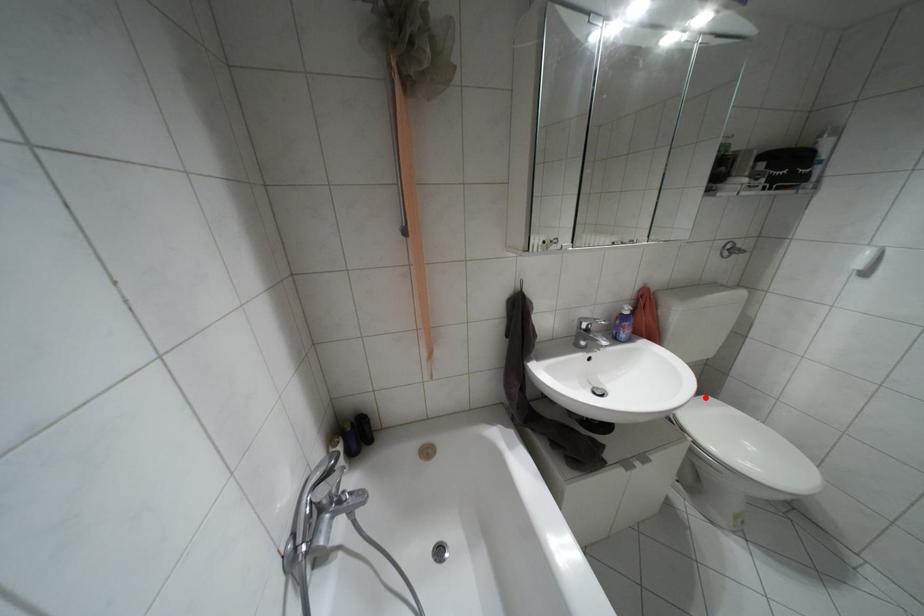
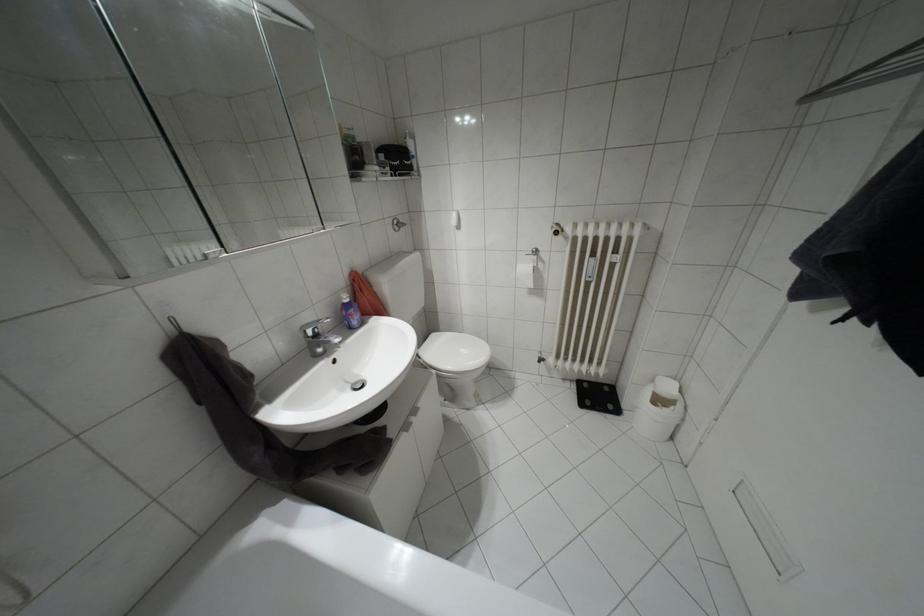
Question: I am providing you with two images of the same scene from different viewpoints. In image1, a red point is highlighted. Considering the same 3D point in image2, which of the following is correct?

Choices:
 (A) It is closer
 (B) It is farther

Answer: (B)